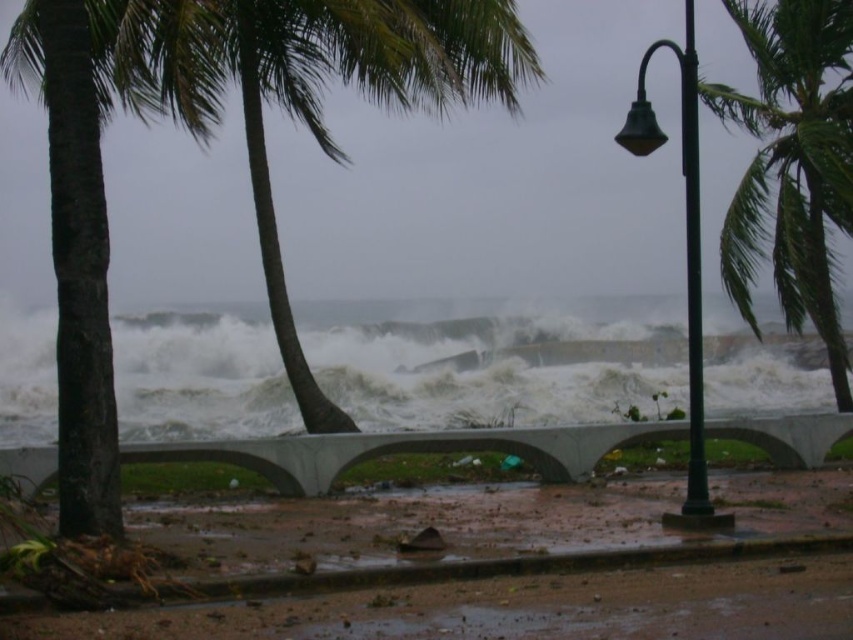
You are a tourist visiting the coastal area and want to take a photo of both the green leafy palm tree at center and the green leafy palm tree at upper right. Which palm tree should you stand closer to in order to capture both in a single frame?

You should stand closer to the green leafy palm tree at upper right because it is smaller in size compared to the green leafy palm tree at center. By positioning yourself nearer to the smaller tree, both trees will be more likely to fit within the camera frame.